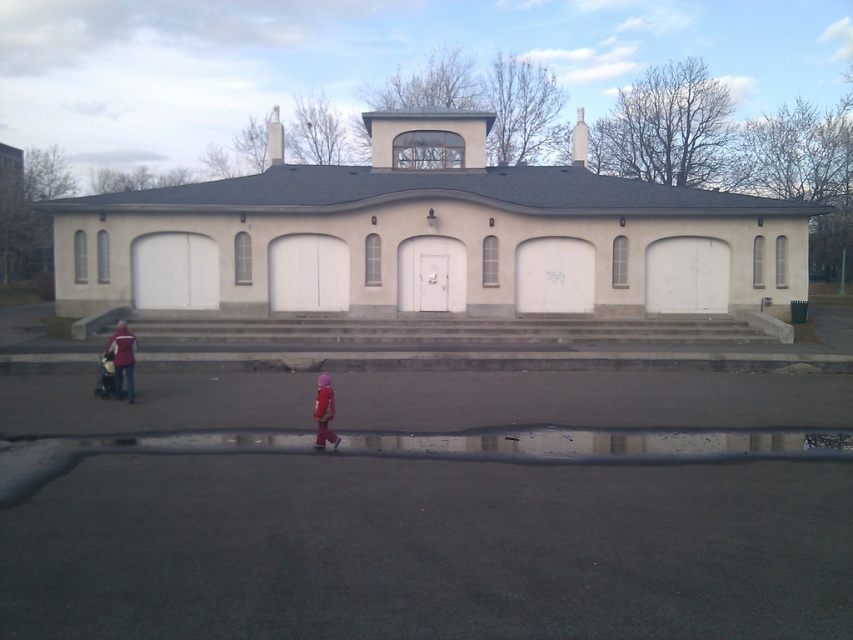
Question: Is concrete stairs at center smaller than matte red jacket at left?

Choices:
 (A) yes
 (B) no

Answer: (A)

Question: Is beige concrete building at center below concrete stairs at center?

Choices:
 (A) yes
 (B) no

Answer: (B)

Question: Which object appears closest to the camera in this image?

Choices:
 (A) beige concrete building at center
 (B) pink fabric coat at lower center

Answer: (B)

Question: Among these points, which one is farthest from the camera?

Choices:
 (A) tap(445, 170)
 (B) tap(125, 372)
 (C) tap(752, 339)
 (D) tap(323, 413)

Answer: (A)

Question: Is beige concrete building at center closer to the viewer compared to matte red jacket at left?

Choices:
 (A) no
 (B) yes

Answer: (A)

Question: Among these objects, which one is farthest from the camera?

Choices:
 (A) concrete stairs at center
 (B) pink fabric coat at lower center
 (C) matte red jacket at left
 (D) beige concrete building at center

Answer: (D)